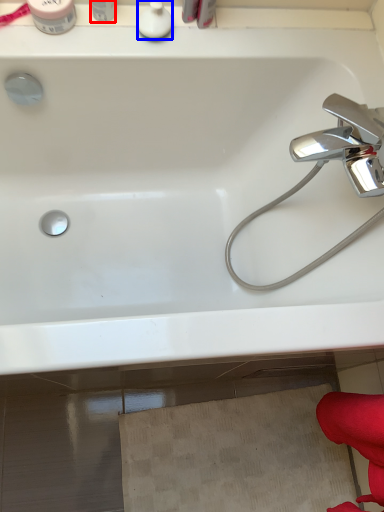
Question: Among these objects, which one is farthest to the camera, toiletry (highlighted by a red box) or toiletry (highlighted by a blue box)?

Choices:
 (A) toiletry
 (B) toiletry

Answer: (B)